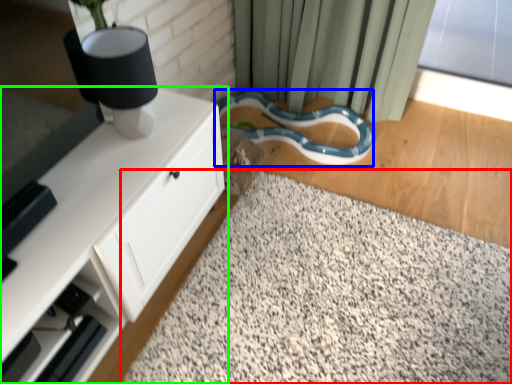
Question: Estimate the real-world distances between objects in this image. Which object is closer to gravel (highlighted by a red box), snake (highlighted by a blue box) or cabinetry (highlighted by a green box)?

Choices:
 (A) snake
 (B) cabinetry

Answer: (B)